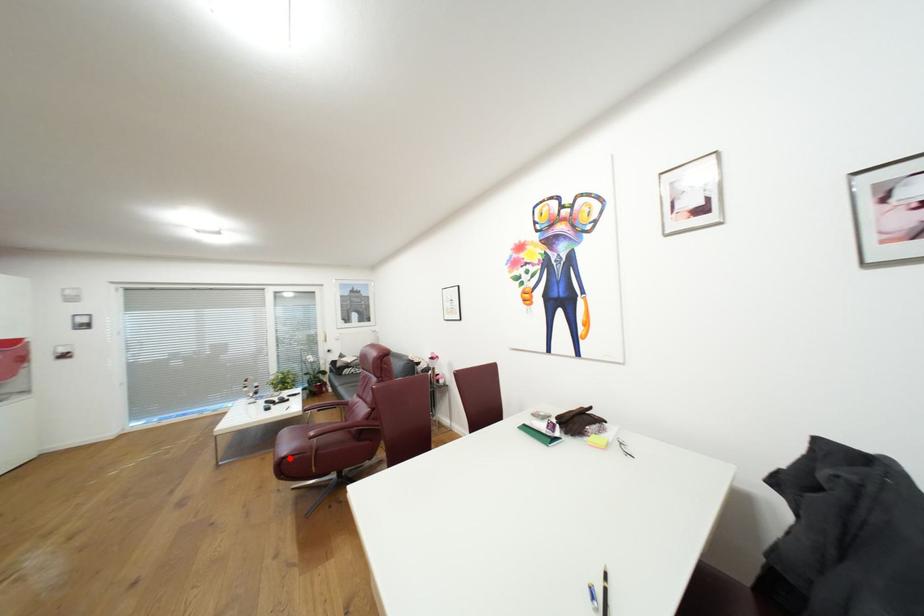
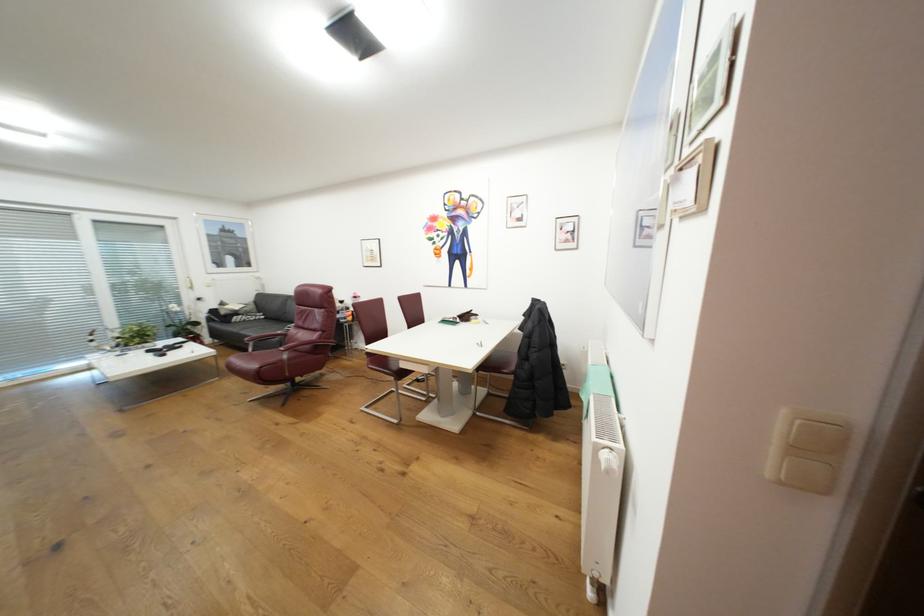
Question: I am providing you with two images of the same scene from different viewpoints. Given a red point in image1, look at the same physical point in image2. Is it:

Choices:
 (A) Closer to the viewpoint
 (B) Farther from the viewpoint

Answer: (A)